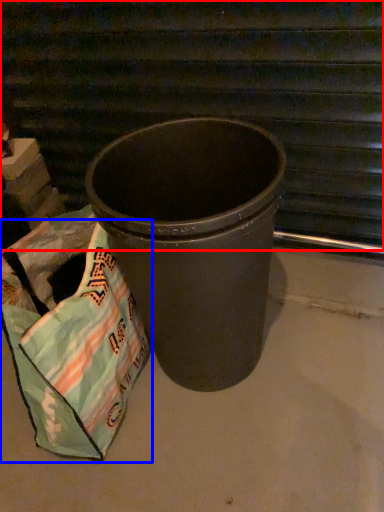
Question: Which object is further to the camera taking this photo, stairwell (highlighted by a red box) or grocery bag (highlighted by a blue box)?

Choices:
 (A) stairwell
 (B) grocery bag

Answer: (A)